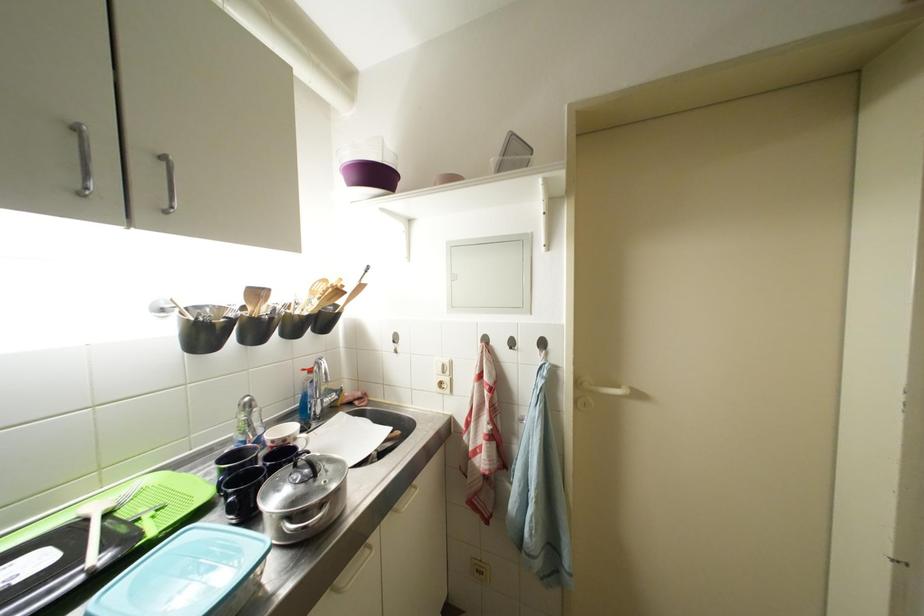
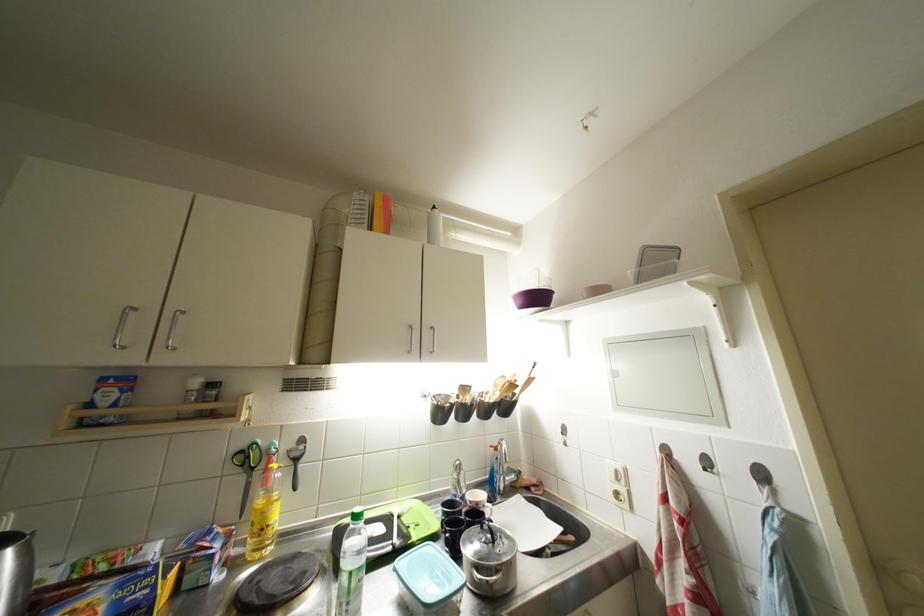
Locate, in the second image, the point that corresponds to [550,347] in the first image.

(769, 479)